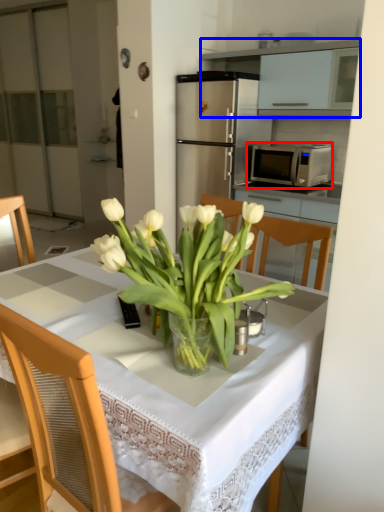
Question: Which of the following is the closest to the observer, microwave oven (highlighted by a red box) or cabinetry (highlighted by a blue box)?

Choices:
 (A) microwave oven
 (B) cabinetry

Answer: (B)